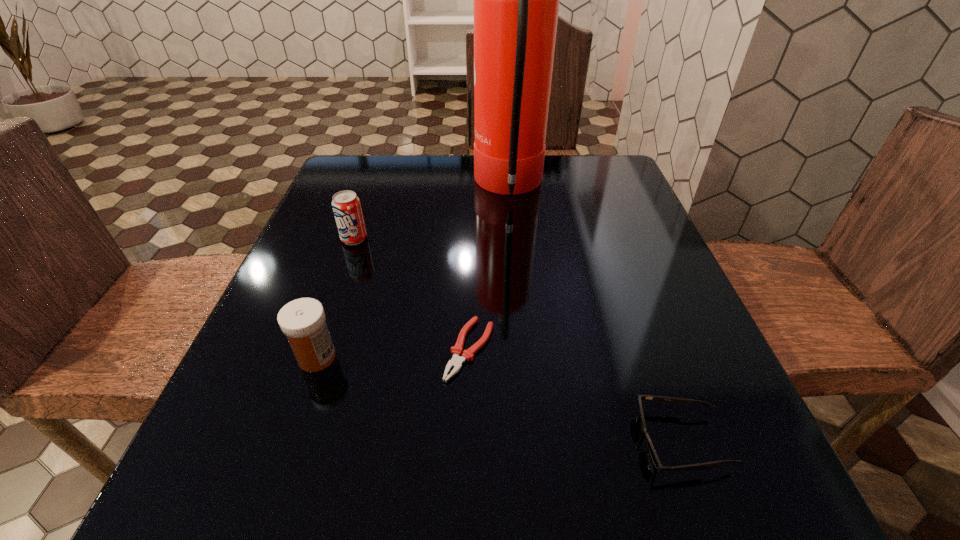
Where is `object that is the third closest to the medicine`? The height and width of the screenshot is (540, 960). object that is the third closest to the medicine is located at coordinates (516, 0).

You are a GUI agent. You are given a task and a screenshot of the screen. Output one action in this format:
    pyautogui.click(x=<x>, y=<y>)
    Task: Click on the free space that satisfies the following two spatial constraints: 1. on the front side of the second farthest object; 2. on the right side of the medicine
    
    Given the screenshot: What is the action you would take?
    pyautogui.click(x=313, y=357)

Locate an element on the screen. Image resolution: width=960 pixels, height=540 pixels. vacant region that satisfies the following two spatial constraints: 1. towards the nozzle of the fire extinguisher; 2. on the front side of the medicine is located at coordinates (525, 357).

Locate an element on the screen. This screenshot has width=960, height=540. vacant position in the image that satisfies the following two spatial constraints: 1. on the front side of the soda can; 2. on the right side of the medicine is located at coordinates (313, 357).